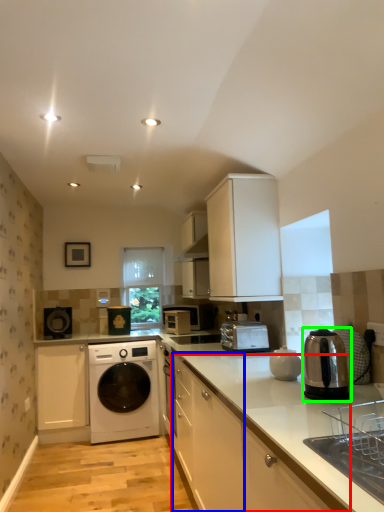
Question: Estimate the real-world distances between objects in this image. Which object is closer to cabinetry (highlighted by a red box), cabinetry (highlighted by a blue box) or home appliance (highlighted by a green box)?

Choices:
 (A) cabinetry
 (B) home appliance

Answer: (A)